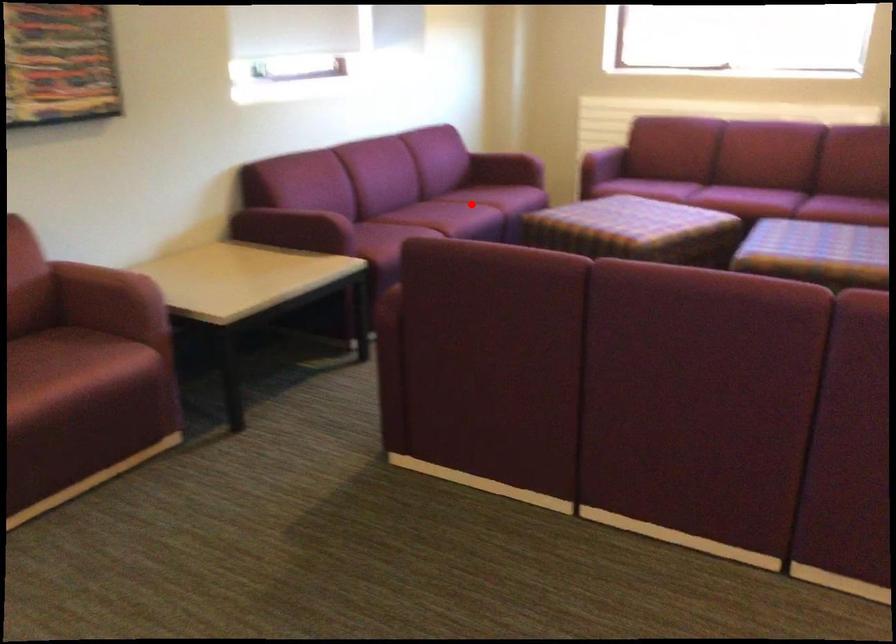
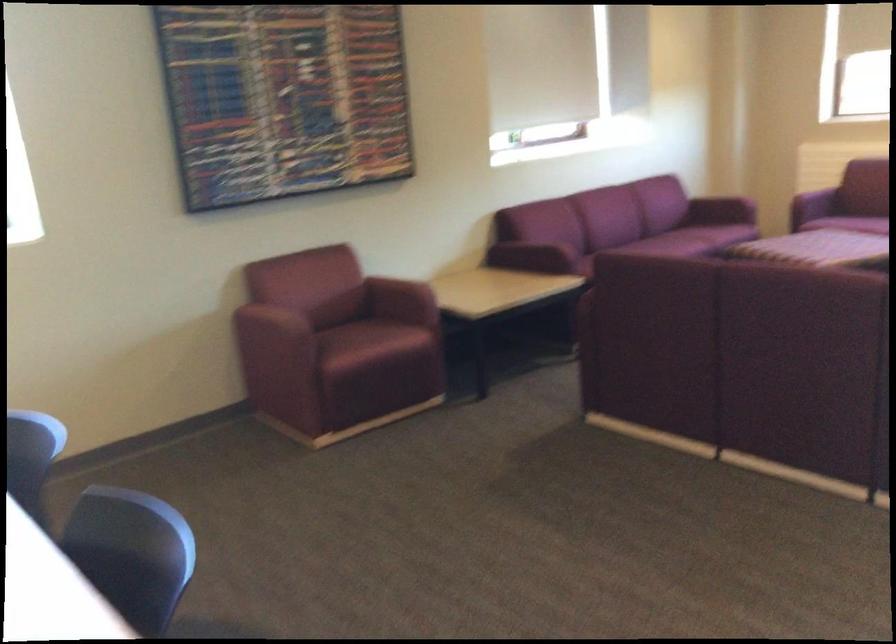
Question: I am providing you with two images of the same scene from different viewpoints. Image1 has a red point marked. In image2, the corresponding 3D location appears at what relative position? Reply with the corresponding letter.

Choices:
 (A) Closer
 (B) Farther

Answer: (B)